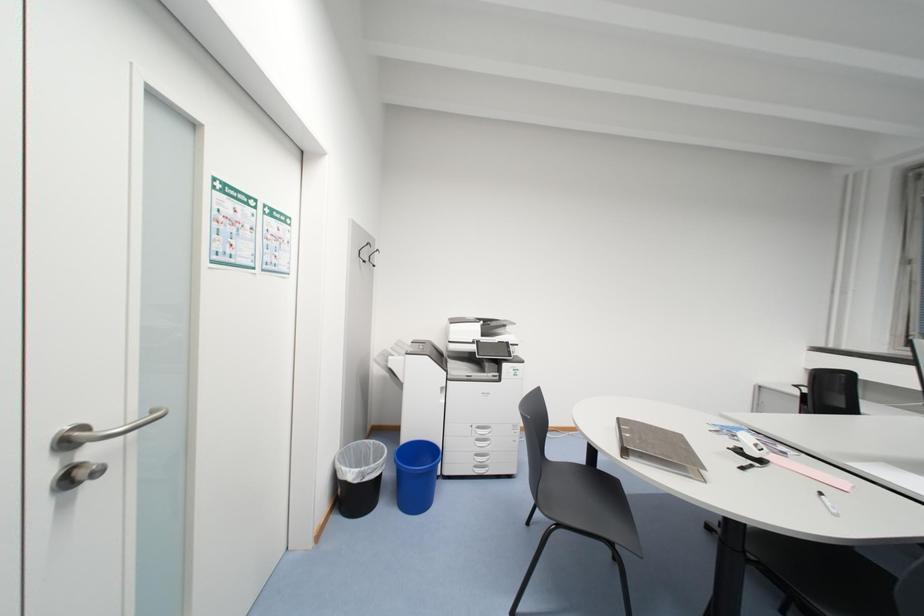
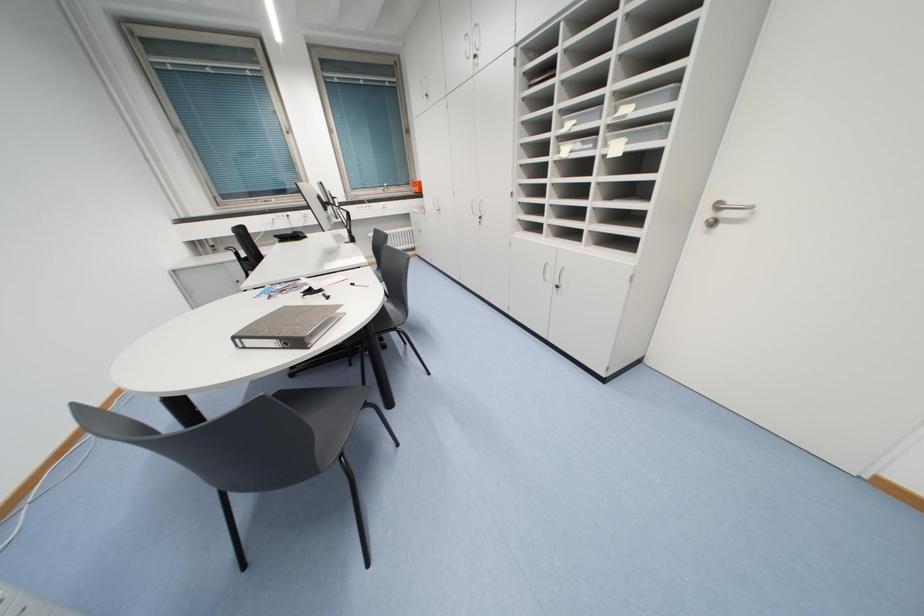
Based on the continuous images, in which direction is the camera rotating?

The rotation direction of the camera is right-down.